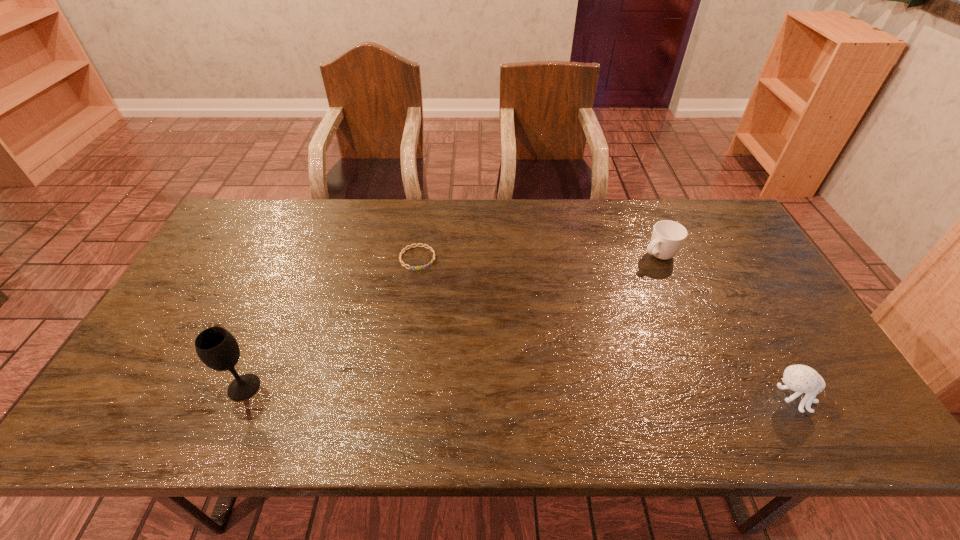
This screenshot has width=960, height=540. In order to click on free space located 0.230m with the handle on the side of the cup in this screenshot , I will do `click(593, 295)`.

Find the location of a particular element. Image resolution: width=960 pixels, height=540 pixels. free region located on the surface of the bracelet showing star-shaped elements is located at coordinates (444, 314).

Where is `free spot located 0.360m on the surface of the bracelet showing star-shaped elements`? free spot located 0.360m on the surface of the bracelet showing star-shaped elements is located at coordinates (466, 363).

Identify the location of free region located on the surface of the bracelet showing star-shaped elements. (441, 309).

Identify the location of wineglass situated at the near edge. (217, 348).

Locate an element on the screen. The height and width of the screenshot is (540, 960). octopus located at the near edge is located at coordinates (800, 378).

Find the location of a particular element. This screenshot has height=540, width=960. object at the right edge is located at coordinates (800, 378).

Locate an element on the screen. This screenshot has width=960, height=540. object positioned at the near right corner is located at coordinates (800, 378).

The image size is (960, 540). Find the location of `vacant area at the far edge`. vacant area at the far edge is located at coordinates (579, 218).

Locate an element on the screen. vacant space at the near edge is located at coordinates (591, 384).